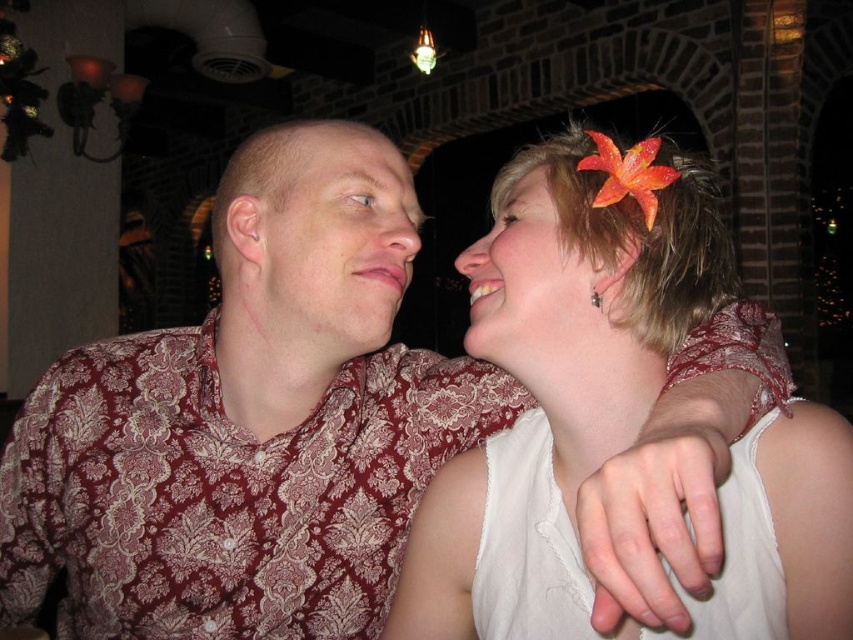
You are a photographer adjusting your camera settings to capture the scene. You notice two white flowers at the upper right corner of the frame. Which of the two, the white fabric flower at upper right or the white matte flower at upper right, should you focus on first to ensure both are in sharp focus?

You should focus on the white fabric flower at upper right first because it is closer to the viewer than the white matte flower at upper right. By focusing on the closer object, the depth of field may help keep both in focus.

You are a photographer adjusting the camera height to ensure both the matte floral shirt at left and the matte skin at center are fully visible in the frame. Which object should you position closer to the camera to achieve this?

The matte floral shirt at left is much taller than the matte skin at center, so positioning the matte floral shirt at left closer to the camera will help ensure both are fully visible in the frame.

You are a photographer trying to capture both the matte floral shirt at left and the matte skin at center in a single frame. Since the camera has a limited focus range, which object should you prioritize focusing on to ensure it appears sharp given their sizes?

The matte floral shirt at left is bigger than the matte skin at center, so you should prioritize focusing on the matte floral shirt at left to ensure it appears sharp since larger objects generally require more precise focus to maintain clarity.